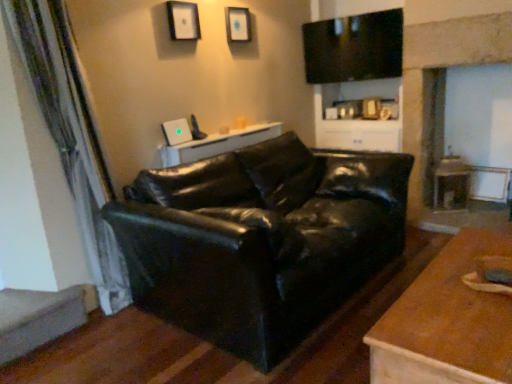
What are the coordinates of `vacant space in front of green textured curtain at left` in the screenshot? It's located at (79, 353).